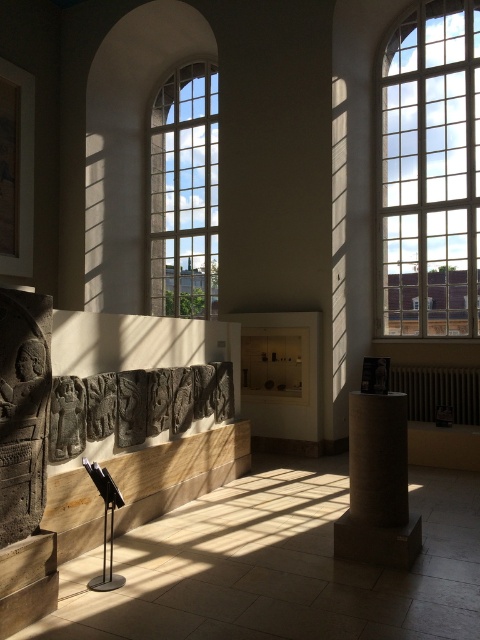
Question: Which is farther from the clear glass window at upper right?

Choices:
 (A) clear glass window at center
 (B) dark gray stone carving at center

Answer: (B)

Question: Is clear glass window at upper right thinner than clear glass window at center?

Choices:
 (A) yes
 (B) no

Answer: (B)

Question: Is the position of clear glass window at center less distant than that of matte stone column at center?

Choices:
 (A) yes
 (B) no

Answer: (B)

Question: Can you confirm if matte stone column at center is bigger than dark gray stone carving at center?

Choices:
 (A) yes
 (B) no

Answer: (A)

Question: Among these points, which one is farthest from the camera?

Choices:
 (A) (425, 144)
 (B) (49, 410)
 (C) (178, 252)

Answer: (C)

Question: Which of the following is the farthest from the observer?

Choices:
 (A) clear glass window at upper right
 (B) matte stone column at center

Answer: (A)